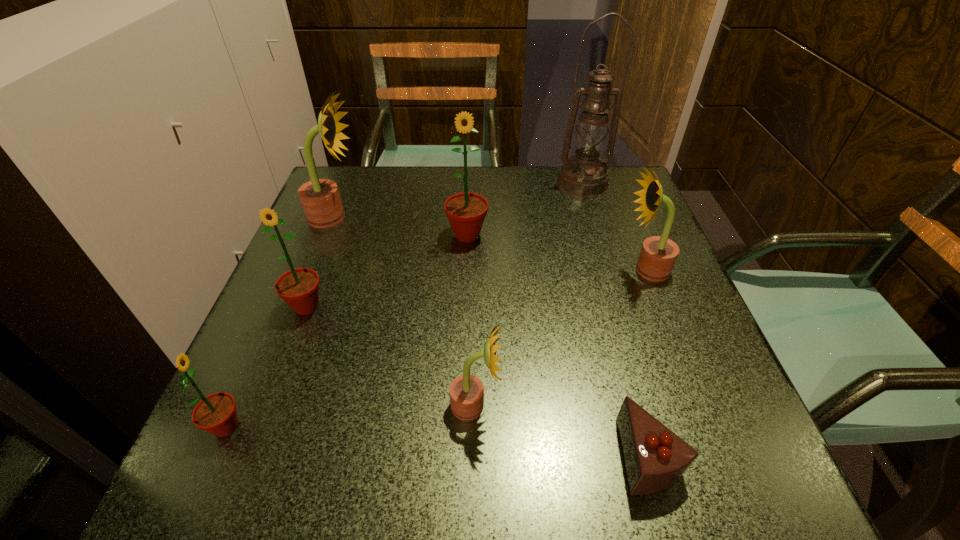
At what (x,y) coordinates should I click in order to perform the action: click on free spot that satisfies the following two spatial constraints: 1. on the face of the shortest object; 2. on the right side of the second nearest green sunflower. Please return your answer as a coordinate pair (x, y). The image size is (960, 540). Looking at the image, I should click on (251, 455).

Where is `vacant space that satisfies the following two spatial constraints: 1. on the front side of the oil lamp; 2. on the face of the biggest yellow sunflower`? This screenshot has width=960, height=540. vacant space that satisfies the following two spatial constraints: 1. on the front side of the oil lamp; 2. on the face of the biggest yellow sunflower is located at coordinates (592, 218).

Image resolution: width=960 pixels, height=540 pixels. Find the location of `vacant space that satisfies the following two spatial constraints: 1. on the face of the second farthest green sunflower; 2. on the face of the smallest green sunflower`. vacant space that satisfies the following two spatial constraints: 1. on the face of the second farthest green sunflower; 2. on the face of the smallest green sunflower is located at coordinates 261,427.

Identify the location of vacant area that satisfies the following two spatial constraints: 1. on the face of the biggest yellow sunflower; 2. on the left side of the chocolate cake. The image size is (960, 540). (240, 455).